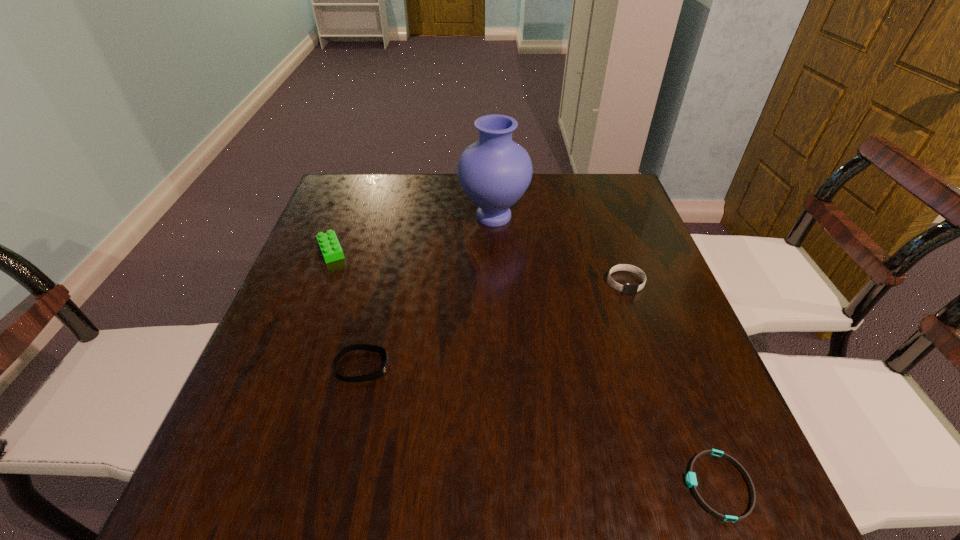
Image resolution: width=960 pixels, height=540 pixels. Identify the location of free spot between the leftmost object and the nearest wristband. (524, 368).

At what (x,y) coordinates should I click in order to perform the action: click on free space that is in between the leftmost object and the nearest wristband. Please return your answer as a coordinate pair (x, y). Looking at the image, I should click on (524, 368).

Where is `vacant area between the tallest wristband and the nearest wristband`? vacant area between the tallest wristband and the nearest wristband is located at coordinates (672, 384).

This screenshot has height=540, width=960. What are the coordinates of `vacant space that's between the shortest object and the leftmost object` in the screenshot? It's located at (524, 368).

Point out which object is positioned as the third nearest to the third object from left to right. Please provide its 2D coordinates. Your answer should be formatted as a tuple, i.e. [(x, y)], where the tuple contains the x and y coordinates of a point satisfying the conditions above.

[(378, 374)]

What are the coordinates of `object that stands as the fourth closest to the shortest object` in the screenshot? It's located at (330, 247).

Point out which wristband is positioned as the second nearest to the vase. Please provide its 2D coordinates. Your answer should be formatted as a tuple, i.e. [(x, y)], where the tuple contains the x and y coordinates of a point satisfying the conditions above.

[(378, 374)]

Identify which wristband is the closest to the second nearest object. Please provide its 2D coordinates. Your answer should be formatted as a tuple, i.e. [(x, y)], where the tuple contains the x and y coordinates of a point satisfying the conditions above.

[(628, 288)]

Find the location of a particular element. The width and height of the screenshot is (960, 540). vacant space that satisfies the following two spatial constraints: 1. on the outer surface of the tallest wristband; 2. on the display of the leftmost wristband is located at coordinates (655, 366).

This screenshot has width=960, height=540. In order to click on vacant space that satisfies the following two spatial constraints: 1. on the back side of the leftmost object; 2. on the left side of the third object from right to left in this screenshot , I will do `click(344, 217)`.